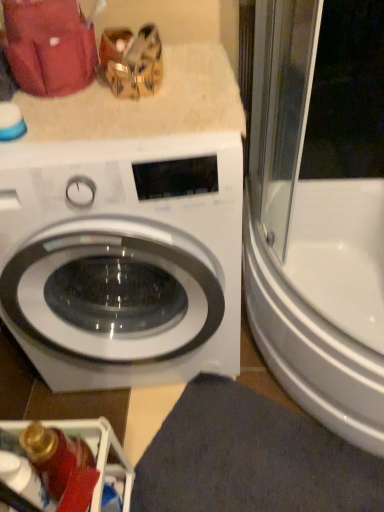
Question: Is white glossy bathtub at right positioned far away from white glossy washing machine at center?

Choices:
 (A) yes
 (B) no

Answer: (B)

Question: Considering the relative sizes of white glossy bathtub at right and white glossy washing machine at center in the image provided, is white glossy bathtub at right bigger than white glossy washing machine at center?

Choices:
 (A) yes
 (B) no

Answer: (B)

Question: Considering the relative positions of white glossy bathtub at right and white glossy washing machine at center in the image provided, is white glossy bathtub at right in front of white glossy washing machine at center?

Choices:
 (A) yes
 (B) no

Answer: (B)

Question: From the image's perspective, is white glossy bathtub at right located beneath white glossy washing machine at center?

Choices:
 (A) no
 (B) yes

Answer: (B)

Question: From a real-world perspective, is white glossy bathtub at right physically below white glossy washing machine at center?

Choices:
 (A) yes
 (B) no

Answer: (A)

Question: Is white glossy washing machine at center in front of or behind white glossy bathtub at right in the image?

Choices:
 (A) front
 (B) behind

Answer: (A)

Question: Considering the positions of point (172, 192) and point (276, 173), is point (172, 192) closer or farther from the camera than point (276, 173)?

Choices:
 (A) farther
 (B) closer

Answer: (B)

Question: From the image's perspective, is white glossy washing machine at center located above or below white glossy bathtub at right?

Choices:
 (A) above
 (B) below

Answer: (A)

Question: Is white glossy washing machine at center taller or shorter than white glossy bathtub at right?

Choices:
 (A) short
 (B) tall

Answer: (B)

Question: Considering their positions, is metallic silver dishwasher at lower left located in front of or behind dark gray fabric bath mat at lower center?

Choices:
 (A) behind
 (B) front

Answer: (B)

Question: From their relative heights in the image, would you say metallic silver dishwasher at lower left is taller or shorter than dark gray fabric bath mat at lower center?

Choices:
 (A) tall
 (B) short

Answer: (A)

Question: In terms of size, does metallic silver dishwasher at lower left appear bigger or smaller than dark gray fabric bath mat at lower center?

Choices:
 (A) big
 (B) small

Answer: (B)

Question: From the image's perspective, relative to dark gray fabric bath mat at lower center, is metallic silver dishwasher at lower left above or below?

Choices:
 (A) above
 (B) below

Answer: (A)

Question: In the image, is white glossy bathtub at right positioned in front of or behind metallic silver dishwasher at lower left?

Choices:
 (A) front
 (B) behind

Answer: (A)

Question: Looking at the image, does white glossy bathtub at right seem bigger or smaller compared to metallic silver dishwasher at lower left?

Choices:
 (A) small
 (B) big

Answer: (B)